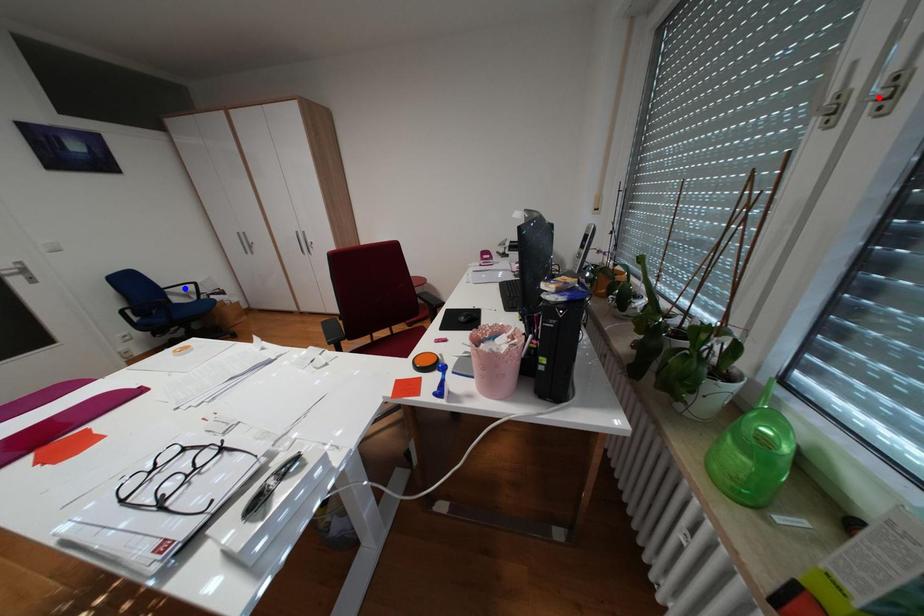
Question: Two points are marked on the image. Which point is closer to the camera?

Choices:
 (A) Blue point is closer.
 (B) Red point is closer.

Answer: (B)